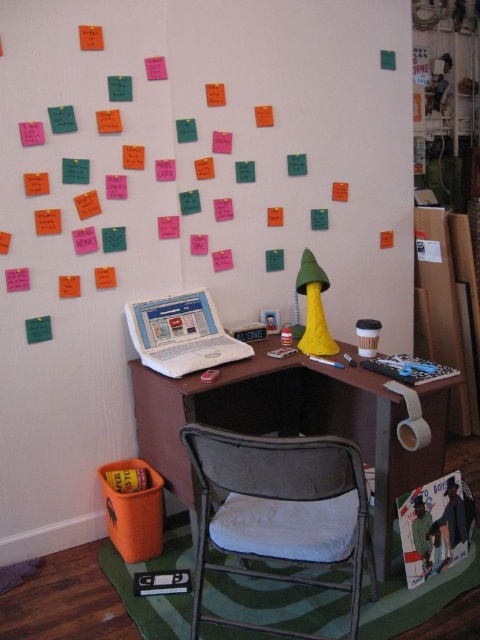
Does brown wood computer desk at center have a lesser height compared to metallic gray folding chair at center?

No, brown wood computer desk at center is not shorter than metallic gray folding chair at center.

Is brown wood computer desk at center smaller than metallic gray folding chair at center?

Actually, brown wood computer desk at center might be larger than metallic gray folding chair at center.

Between point (265, 392) and point (340, 467), which one is positioned in front?

Point (340, 467) is more forward.

Locate an element on the screen. brown wood computer desk at center is located at coordinates (292, 422).

Does point (166, 416) come behind point (183, 365)?

Yes, point (166, 416) is farther from viewer.

Which is above, brown wood computer desk at center or white plastic laptop at center?

Positioned higher is white plastic laptop at center.

Does point (189, 474) come behind point (204, 365)?

No, (189, 474) is closer to viewer.

Identify the location of brown wood computer desk at center. (292, 422).

Can you confirm if metallic gray folding chair at center is positioned to the left of white plastic laptop at center?

Incorrect, metallic gray folding chair at center is not on the left side of white plastic laptop at center.

Does metallic gray folding chair at center come behind white plastic laptop at center?

No.

Measure the distance between point (319, 548) and camera.

Point (319, 548) and camera are 1.33 meters apart.

You are a GUI agent. You are given a task and a screenshot of the screen. Output one action in this format:
    pyautogui.click(x=<x>, y=<y>)
    Task: Click on the metallic gray folding chair at center
    The width and height of the screenshot is (480, 640).
    Given the screenshot: What is the action you would take?
    pyautogui.click(x=280, y=509)